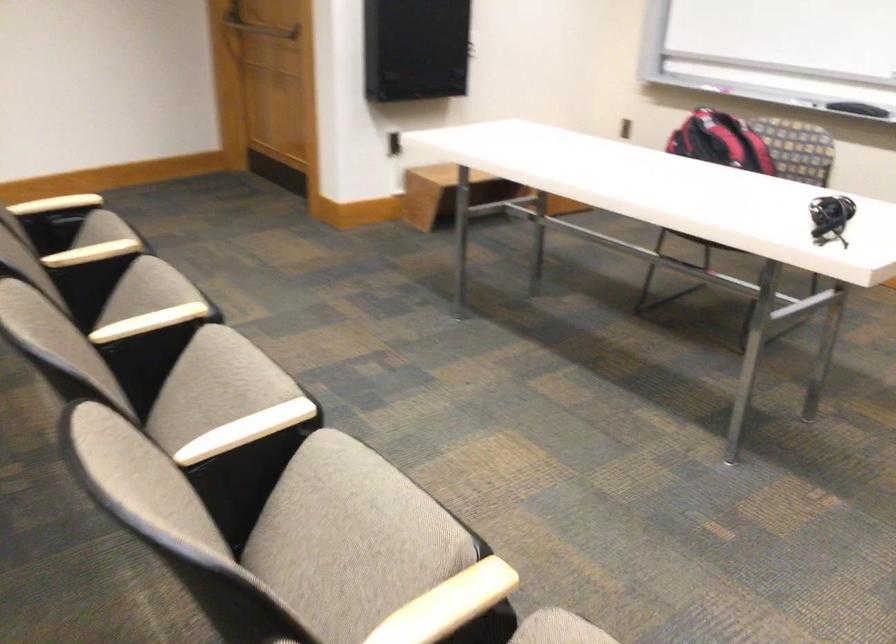
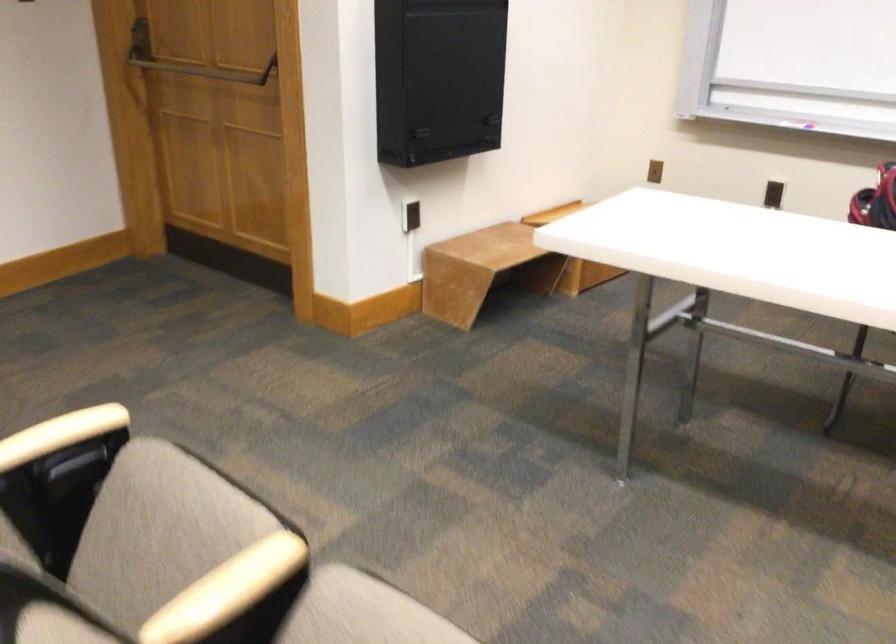
What movement of the cameraman would produce the second image?

The cameraman walked toward left, forward.